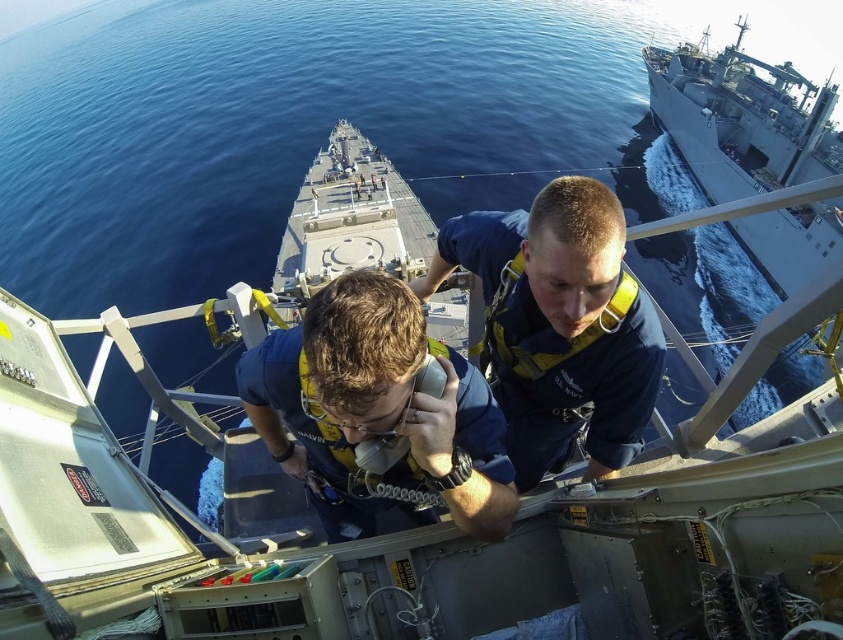
Is blue fabric uniform at center shorter than gray metallic ship at upper right?

Yes, blue fabric uniform at center is shorter than gray metallic ship at upper right.

Between point (447, 388) and point (691, 150), which one is positioned in front?

Point (447, 388)

Locate an element on the screen. The width and height of the screenshot is (843, 640). blue fabric uniform at center is located at coordinates (376, 406).

Image resolution: width=843 pixels, height=640 pixels. Identify the location of blue fabric sailor at center. (559, 324).

Is blue fabric sailor at center in front of blue fabric uniform at center?

No.

This screenshot has width=843, height=640. I want to click on blue fabric sailor at center, so point(559,324).

The height and width of the screenshot is (640, 843). What are the coordinates of `blue fabric sailor at center` in the screenshot? It's located at (559, 324).

Between blue fabric sailor at center and gray metallic ship at upper right, which one has less height?

Standing shorter between the two is blue fabric sailor at center.

Who is positioned more to the right, blue fabric sailor at center or gray metallic ship at upper right?

From the viewer's perspective, gray metallic ship at upper right appears more on the right side.

Is point (478, 228) positioned behind point (815, 218)?

No, it is not.

The height and width of the screenshot is (640, 843). In order to click on blue fabric sailor at center in this screenshot , I will do `click(559, 324)`.